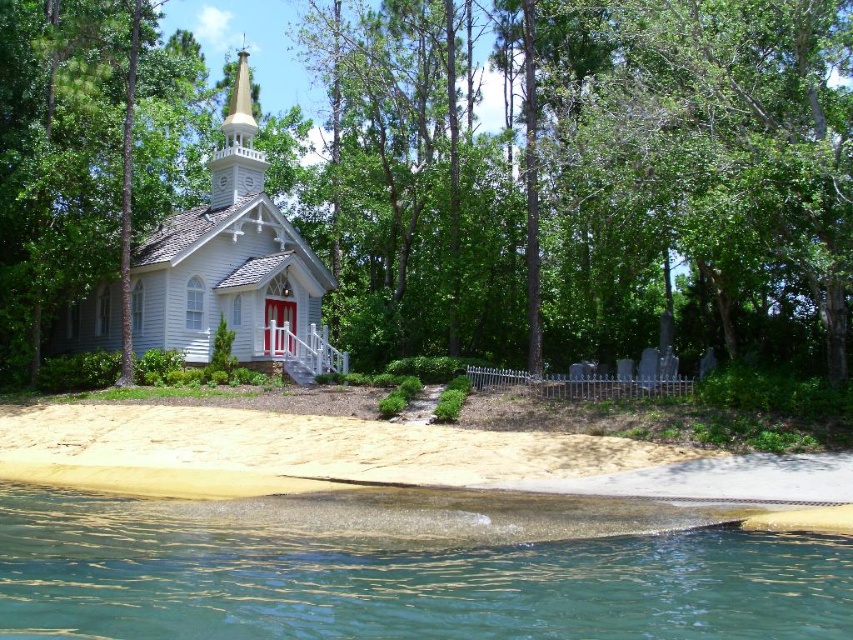
Question: Which is farther from the clear glass water at lower left?

Choices:
 (A) sandy shore at lower left
 (B) white wooden church at center
 (C) green leafy tree at center

Answer: (C)

Question: Is green leafy tree at center positioned before white wooden church at center?

Choices:
 (A) yes
 (B) no

Answer: (A)

Question: Does sandy shore at lower left have a smaller size compared to white wooden church at center?

Choices:
 (A) no
 (B) yes

Answer: (B)

Question: Based on their relative distances, which object is nearer to the clear glass water at lower left?

Choices:
 (A) sandy shore at lower left
 (B) white wooden church at center

Answer: (A)

Question: Can you confirm if green leafy tree at center is smaller than sandy shore at lower left?

Choices:
 (A) yes
 (B) no

Answer: (B)

Question: Which of the following is the closest to the observer?

Choices:
 (A) white wooden church at center
 (B) sandy shore at lower left

Answer: (B)